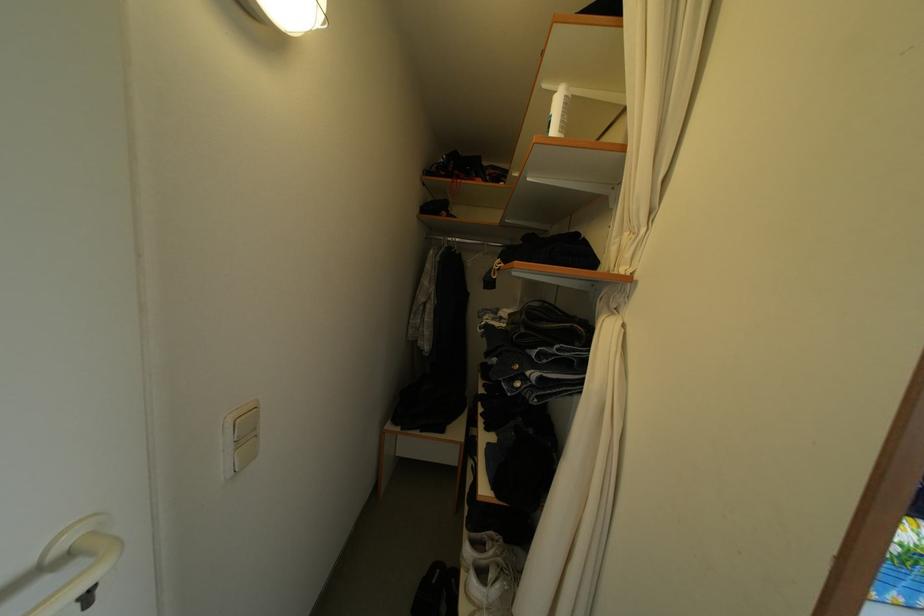
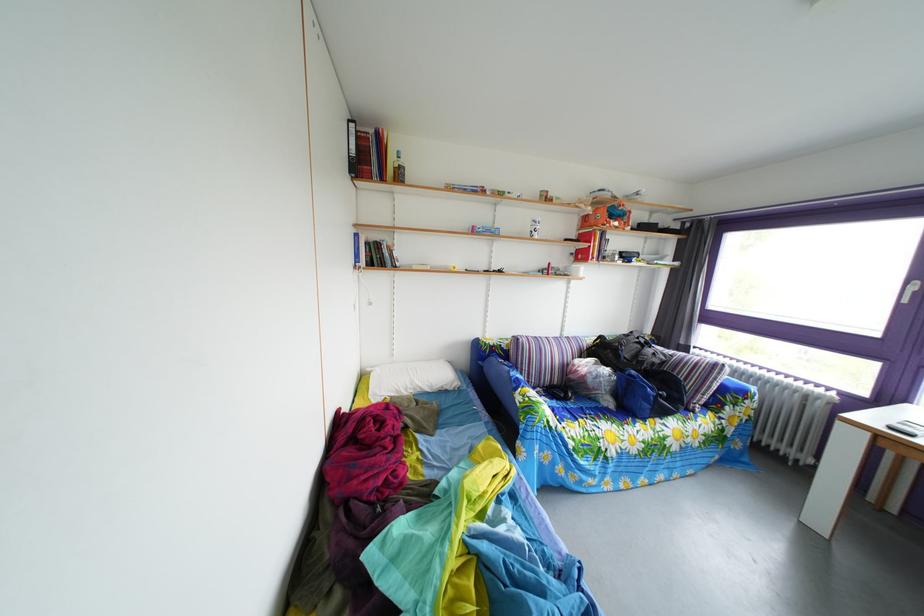
Question: The camera is either moving clockwise (left) or counter-clockwise (right) around the object. The first image is from the beginning of the video and the second image is from the end. Is the camera moving left or right when shooting the video?

Choices:
 (A) Left
 (B) Right

Answer: (A)